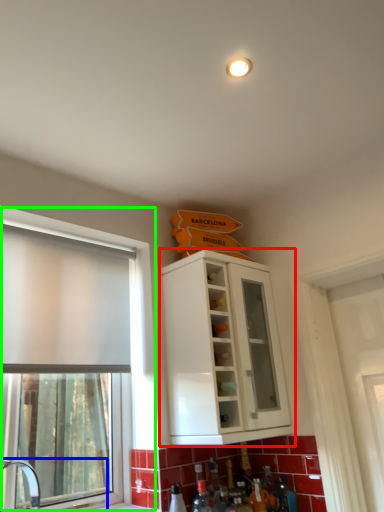
Question: Which is farther away from cabinetry (highlighted by a red box)? sink (highlighted by a blue box) or window (highlighted by a green box)?

Choices:
 (A) sink
 (B) window

Answer: (A)